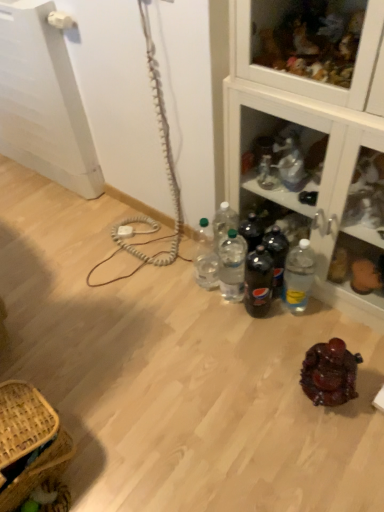
You are a GUI agent. You are given a task and a screenshot of the screen. Output one action in this format:
    pyautogui.click(x=<x>, y=<y>)
    Task: Click on the vacant space in front of dark glass bottle at center, the third bottle viewed from the left
    This screenshot has width=384, height=512.
    Given the screenshot: What is the action you would take?
    pyautogui.click(x=266, y=347)